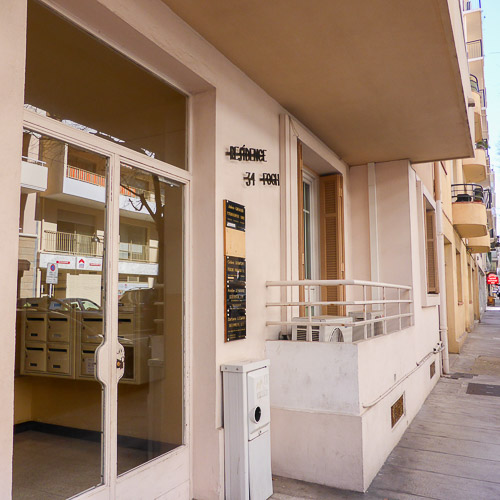
Identify the location of vents. The width and height of the screenshot is (500, 500). (397, 409), (432, 369).